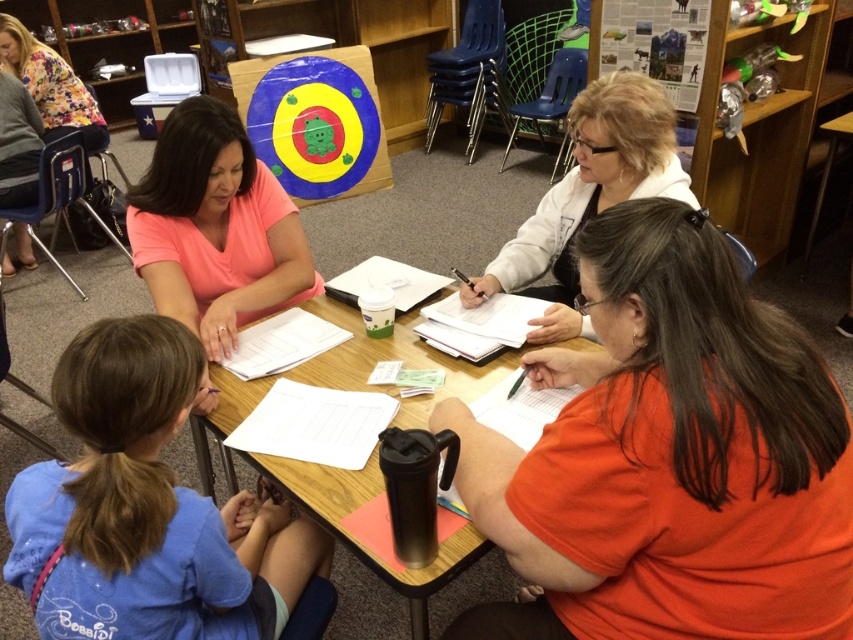
Question: Among these objects, which one is nearest to the camera?

Choices:
 (A) blue cotton shirt at lower left
 (B) black plastic table at center

Answer: (A)

Question: Is orange matte shirt at center to the right of pink matte shirt at upper left from the viewer's perspective?

Choices:
 (A) yes
 (B) no

Answer: (A)

Question: Considering the relative positions of pink matte shirt at upper left and black plastic table at center in the image provided, where is pink matte shirt at upper left located with respect to black plastic table at center?

Choices:
 (A) below
 (B) above

Answer: (B)

Question: Which point appears closest to the camera in this image?

Choices:
 (A) (175, 131)
 (B) (195, 576)

Answer: (B)

Question: Can you confirm if pink matte shirt at upper left is positioned below black plastic table at center?

Choices:
 (A) no
 (B) yes

Answer: (A)

Question: Which of the following is the farthest from the observer?

Choices:
 (A) orange matte shirt at center
 (B) black plastic table at center

Answer: (B)